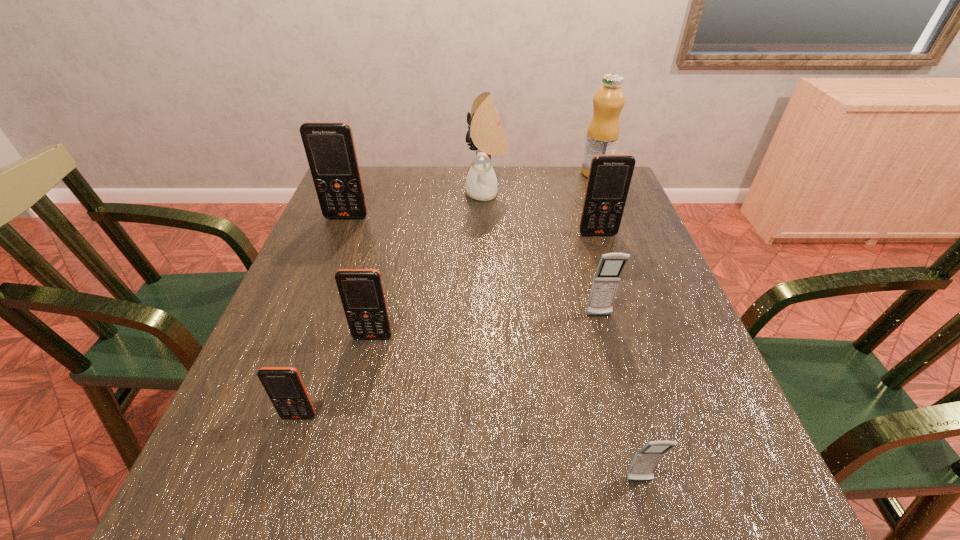
I want to click on free location that satisfies the following two spatial constraints: 1. on the front label of the fruit juice; 2. on the screen of the tallest cellular telephone, so click(612, 217).

Find the location of a particular element. This screenshot has height=540, width=960. free location that satisfies the following two spatial constraints: 1. at the front face of the black doll; 2. on the screen of the second nearest cellular telephone is located at coordinates (490, 416).

The image size is (960, 540). What are the coordinates of `free spot that satisfies the following two spatial constraints: 1. on the front label of the fruit juice; 2. on the screen of the fourth tallest object` in the screenshot? It's located at (619, 234).

I want to click on vacant space that satisfies the following two spatial constraints: 1. on the front label of the fruit juice; 2. on the front-facing side of the smaller gray cellular telephone, so click(716, 481).